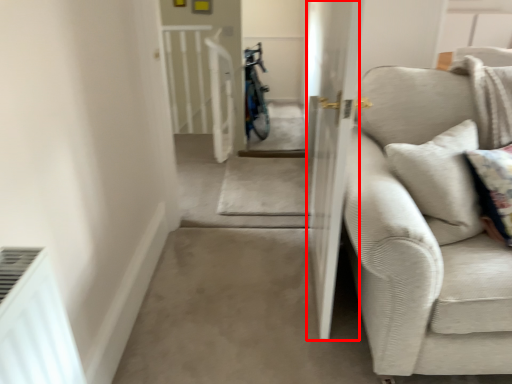
Question: From the image's perspective, considering the relative positions of screen door (annotated by the red box) and studio couch in the image provided, where is screen door (annotated by the red box) located with respect to the staircase?

Choices:
 (A) above
 (B) below

Answer: (A)